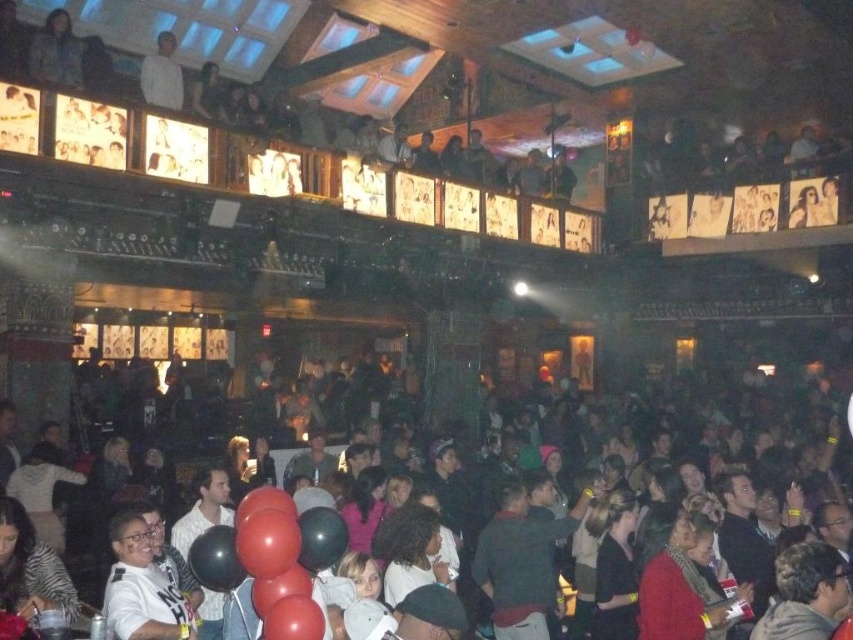
Question: Which is farther from the white matte shirt at upper left?

Choices:
 (A) black glossy balloons at lower center
 (B) black rubber balloon at center

Answer: (A)

Question: Among these points, which one is farthest from the camera?

Choices:
 (A) (483, 492)
 (B) (219, 580)

Answer: (A)

Question: Among these points, which one is farthest from the camera?

Choices:
 (A) (154, 84)
 (B) (766, 412)
 (C) (236, 566)

Answer: (B)

Question: Is black glossy balloons at lower center positioned before white matte shirt at upper left?

Choices:
 (A) no
 (B) yes

Answer: (B)

Question: Is black glossy balloons at lower center to the left of white matte shirt at upper left from the viewer's perspective?

Choices:
 (A) no
 (B) yes

Answer: (A)

Question: Does black rubber balloon at center have a lesser width compared to white matte shirt at upper left?

Choices:
 (A) yes
 (B) no

Answer: (A)